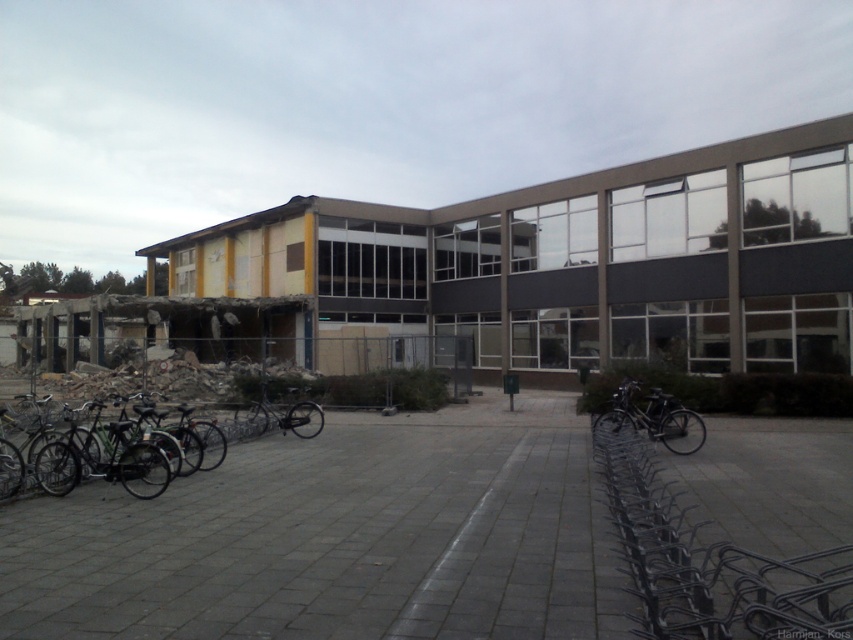
You are a delivery person trying to park your bicycle between the shiny black bicycle at left and the black matte bicycle at lower right. Is there enough space between them for your bicycle?

The shiny black bicycle at left is to the left of black matte bicycle at lower right, so there is space between them for your bicycle.

You are a delivery person who needs to park your bike near the modern building. You see the metallic silver bike rack at lower right and the black matte bicycle at lower right. How far apart are these two objects?

The metallic silver bike rack at lower right is 28.08 feet from the black matte bicycle at lower right, so they are quite far apart.

You are a delivery person trying to access the black matte bicycle at lower right parked near the metallic silver bike rack at lower right. Is the bike rack blocking your path to the bicycle?

The metallic silver bike rack at lower right is positioned over the black matte bicycle at lower right, so the bike rack is blocking your path to the bicycle.